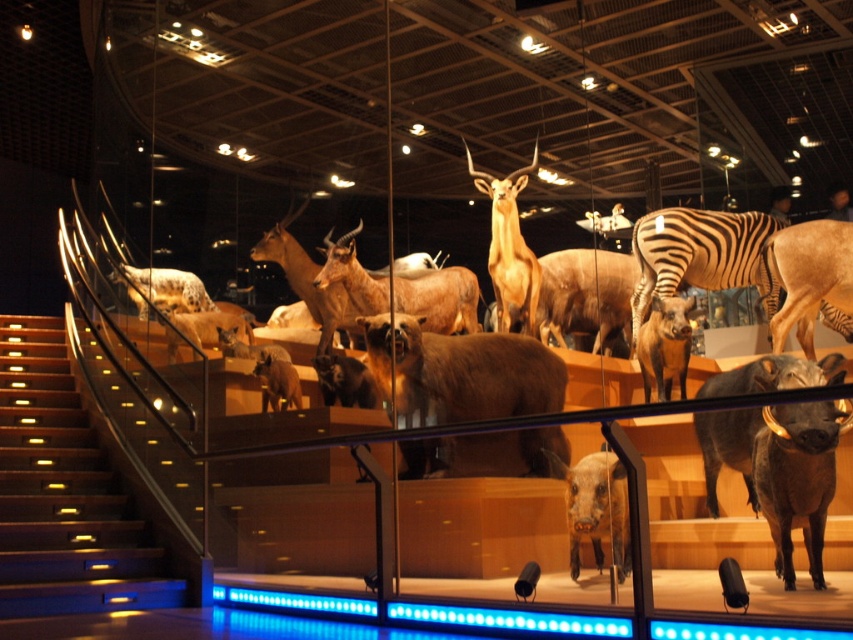
Can you confirm if brown matte cow at center is bigger than brown matte pig at center?

Correct, brown matte cow at center is larger in size than brown matte pig at center.

Does brown matte cow at center have a lesser width compared to brown matte pig at center?

No.

Is point (572, 316) closer to camera compared to point (567, 474)?

No, it is not.

The width and height of the screenshot is (853, 640). I want to click on brown matte cow at center, so click(585, 296).

Which is more to the right, dark brown textured boar at center or brown matte deer at center?

dark brown textured boar at center

Is dark brown textured boar at center below brown matte deer at center?

Yes.

Is point (741, 476) farther from viewer compared to point (459, 305)?

No, (741, 476) is in front of (459, 305).

The height and width of the screenshot is (640, 853). In order to click on dark brown textured boar at center in this screenshot , I will do `click(726, 449)`.

Between dark brown textured boar at center and golden polished antelope at center, which one has more height?

golden polished antelope at center

Is dark brown textured boar at center above golden polished antelope at center?

Incorrect, dark brown textured boar at center is not positioned above golden polished antelope at center.

Is point (744, 364) farther from camera compared to point (500, 227)?

That is False.

You are a GUI agent. You are given a task and a screenshot of the screen. Output one action in this format:
    pyautogui.click(x=<x>, y=<y>)
    Task: Click on the dark brown textured boar at center
    This screenshot has width=853, height=640.
    Given the screenshot: What is the action you would take?
    pyautogui.click(x=726, y=449)